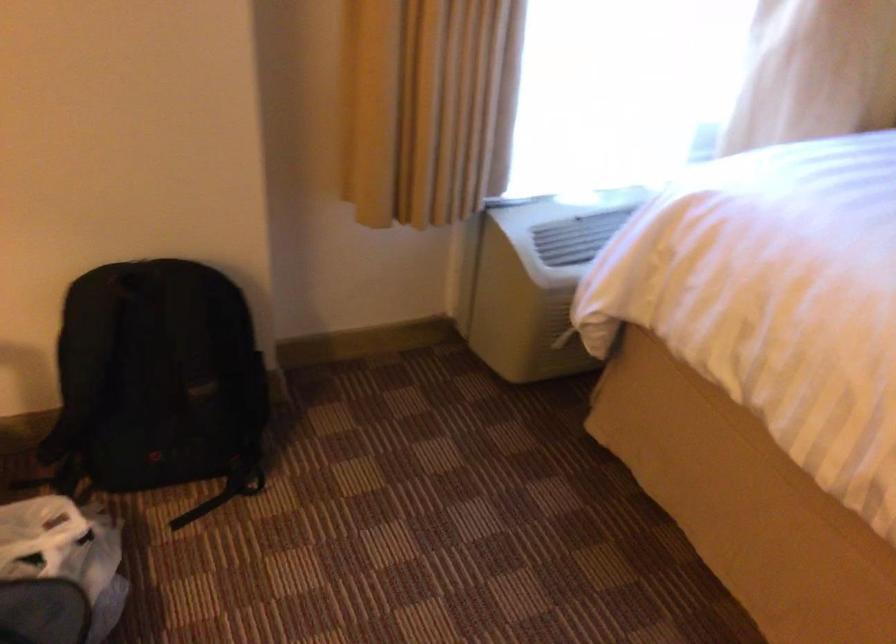
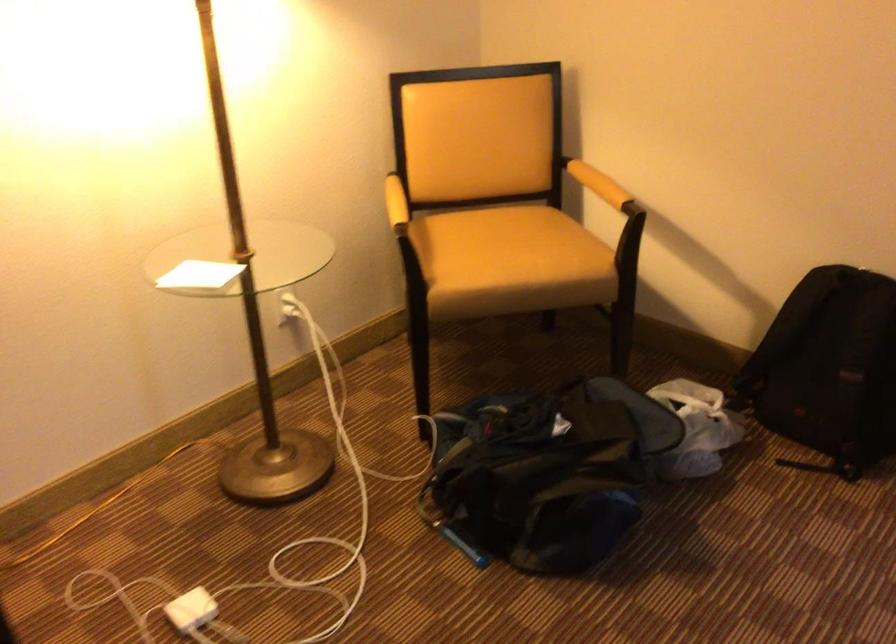
Find the pixel in the second image that matches point (85, 565) in the first image.

(696, 428)